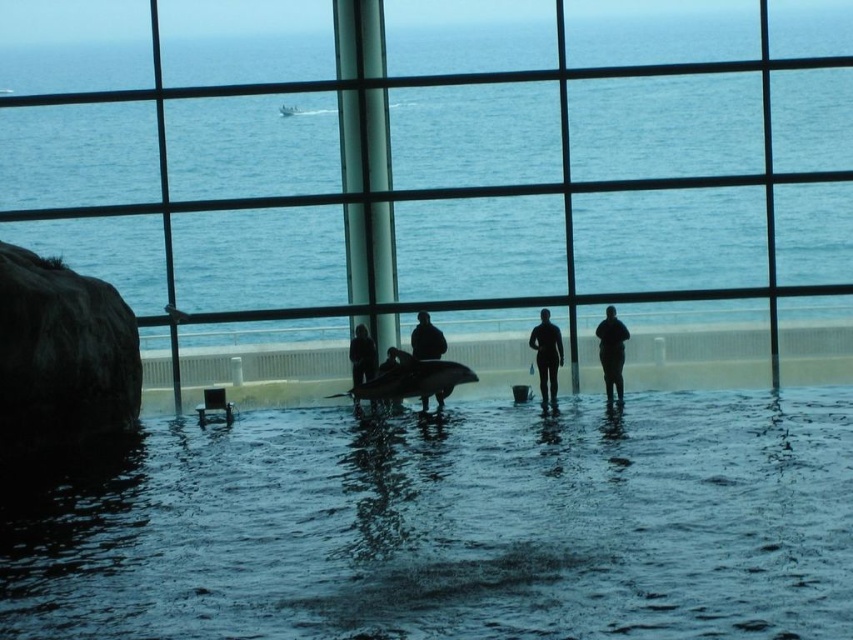
Question: Can you confirm if transparent glass window at center is positioned below matte black dolphin at center?

Choices:
 (A) yes
 (B) no

Answer: (B)

Question: Considering the relative positions of matte black dolphin at center and silhouette rubber suit at center in the image provided, where is matte black dolphin at center located with respect to silhouette rubber suit at center?

Choices:
 (A) left
 (B) right

Answer: (A)

Question: Which of these objects is positioned closest to the matte black dolphin at center?

Choices:
 (A) transparent glass pool at center
 (B) smooth dark skin at center
 (C) transparent glass window at center

Answer: (B)

Question: Can you confirm if transparent glass window at center is positioned to the left of matte black dolphin at center?

Choices:
 (A) no
 (B) yes

Answer: (A)

Question: Estimate the real-world distances between objects in this image. Which object is farther from the smooth dark skin at center?

Choices:
 (A) silhouette rubber suit at center
 (B) dark matte wetsuit at center
 (C) silhouette wetsuit at center
 (D) transparent glass window at center

Answer: (A)

Question: Which point appears closest to the camera in this image?

Choices:
 (A) (357, 342)
 (B) (405, 378)
 (C) (550, 353)

Answer: (B)